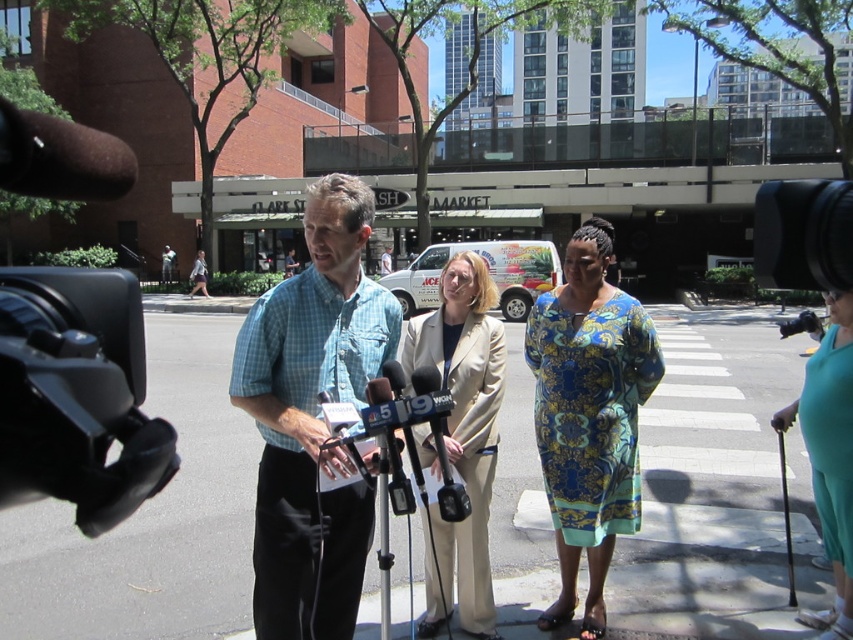
Question: Which point appears closest to the camera in this image?

Choices:
 (A) (416, 337)
 (B) (22, 298)
 (C) (825, 468)
 (D) (326, 346)

Answer: (B)

Question: Does blue floral dress at center have a greater width compared to beige fabric suit at center?

Choices:
 (A) no
 (B) yes

Answer: (A)

Question: Which point appears closest to the camera in this image?

Choices:
 (A) (466, 620)
 (B) (637, 374)
 (C) (842, 385)

Answer: (C)

Question: Can you confirm if blue floral dress at center is positioned above beige fabric suit at center?

Choices:
 (A) yes
 (B) no

Answer: (B)

Question: Which point is closer to the camera?

Choices:
 (A) 850,502
 (B) 103,433
 (C) 560,344

Answer: (B)

Question: Is black matte video camera at left further to the viewer compared to beige fabric suit at center?

Choices:
 (A) yes
 (B) no

Answer: (B)